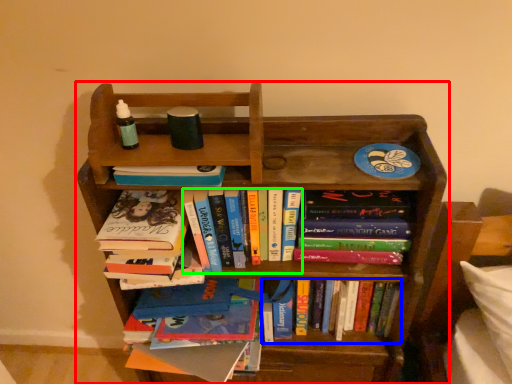
Question: Considering the real-world distances, which object is closest to bookcase (highlighted by a red box)? book (highlighted by a blue box) or book (highlighted by a green box).

Choices:
 (A) book
 (B) book

Answer: (B)